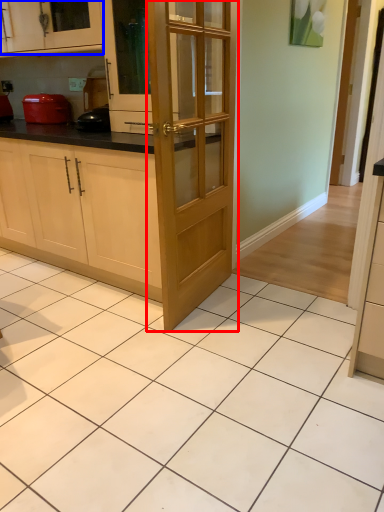
Question: Which point is closer to the camera, door (highlighted by a red box) or cabinetry (highlighted by a blue box)?

Choices:
 (A) door
 (B) cabinetry

Answer: (A)